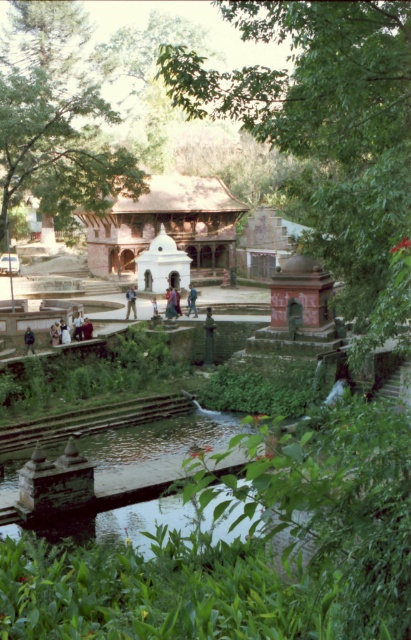
Is point (46, 157) positioned before point (83, 323)?

No.

Is green leafy tree at upper left taller than dark blue jeans at lower left?

Indeed, green leafy tree at upper left has a greater height compared to dark blue jeans at lower left.

The height and width of the screenshot is (640, 411). What do you see at coordinates (57, 148) in the screenshot?
I see `green leafy tree at upper left` at bounding box center [57, 148].

At what (x,y) coordinates should I click in order to perform the action: click on green leafy tree at upper left. Please return your answer as a coordinate pair (x, y). The image size is (411, 640). Looking at the image, I should click on tap(57, 148).

Who is taller, white stone gazebo at center or dark blue jeans at lower left?

white stone gazebo at center

Does white stone gazebo at center appear under dark blue jeans at lower left?

Actually, white stone gazebo at center is above dark blue jeans at lower left.

Find the location of a particular element. white stone gazebo at center is located at coordinates (163, 266).

Locate an element on the screen. This screenshot has height=640, width=411. white stone gazebo at center is located at coordinates (163, 266).

Who is positioned more to the left, green leafy tree at upper left or brown wooden gazebo at center?

green leafy tree at upper left

Which is above, green leafy tree at upper left or brown wooden gazebo at center?

Positioned higher is green leafy tree at upper left.

Is point (16, 202) more distant than point (182, 224)?

That is False.

The height and width of the screenshot is (640, 411). I want to click on green leafy tree at upper left, so click(x=57, y=148).